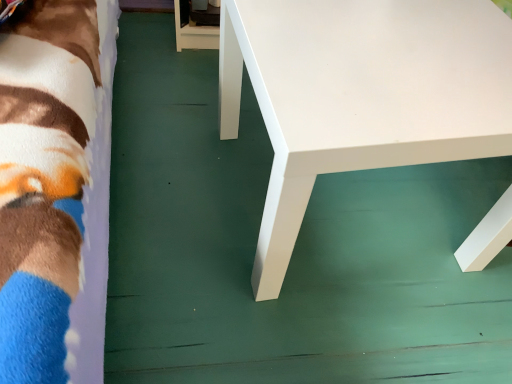
Identify the location of vacant area situated below white matte table at center (from a real-world perspective). This screenshot has height=384, width=512. (351, 213).